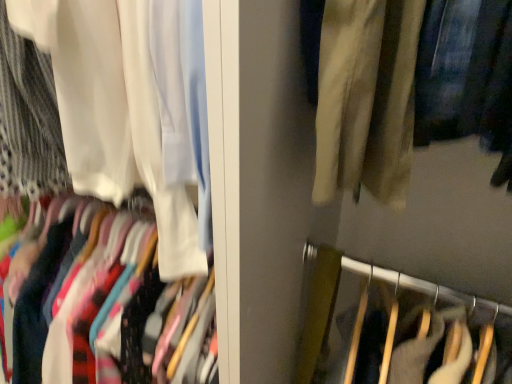
Question: Should I look upward or downward to see velvet fabric pants at center?

Choices:
 (A) up
 (B) down

Answer: (B)

Question: Can you confirm if velvet fabric pants at center is thinner than white sheer curtain at upper left?

Choices:
 (A) yes
 (B) no

Answer: (B)

Question: Considering the relative sizes of velvet fabric pants at center and white sheer curtain at upper left in the image provided, is velvet fabric pants at center shorter than white sheer curtain at upper left?

Choices:
 (A) no
 (B) yes

Answer: (A)

Question: From a real-world perspective, is velvet fabric pants at center below white sheer curtain at upper left?

Choices:
 (A) no
 (B) yes

Answer: (B)

Question: Considering the relative sizes of velvet fabric pants at center and white sheer curtain at upper left in the image provided, is velvet fabric pants at center smaller than white sheer curtain at upper left?

Choices:
 (A) no
 (B) yes

Answer: (B)

Question: Is velvet fabric pants at center positioned with its back to white sheer curtain at upper left?

Choices:
 (A) no
 (B) yes

Answer: (A)

Question: Is velvet fabric pants at center with white sheer curtain at upper left?

Choices:
 (A) yes
 (B) no

Answer: (B)

Question: Is white sheer curtain at upper left positioned far away from velvet fabric pants at center?

Choices:
 (A) yes
 (B) no

Answer: (B)

Question: Can you confirm if white sheer curtain at upper left is positioned to the left of velvet fabric pants at center?

Choices:
 (A) yes
 (B) no

Answer: (A)

Question: Is white sheer curtain at upper left not inside velvet fabric pants at center?

Choices:
 (A) no
 (B) yes

Answer: (B)

Question: Can you confirm if white sheer curtain at upper left is thinner than velvet fabric pants at center?

Choices:
 (A) yes
 (B) no

Answer: (A)

Question: Is white sheer curtain at upper left oriented away from velvet fabric pants at center?

Choices:
 (A) no
 (B) yes

Answer: (A)

Question: From the image's perspective, is white sheer curtain at upper left located above velvet fabric pants at center?

Choices:
 (A) no
 (B) yes

Answer: (B)

Question: From their relative heights in the image, would you say velvet fabric pants at center is taller or shorter than white sheer curtain at upper left?

Choices:
 (A) short
 (B) tall

Answer: (B)